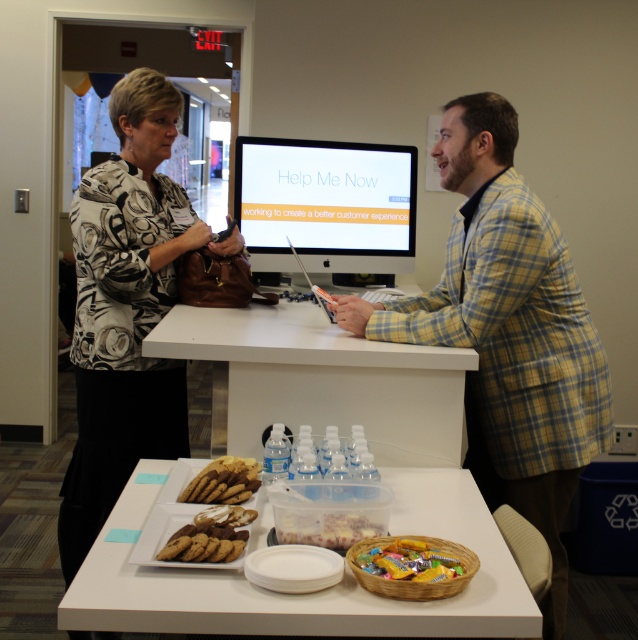
Question: Among these objects, which one is nearest to the camera?

Choices:
 (A) golden crumbly cookies at center
 (B) white plastic table at center

Answer: (A)

Question: Can you confirm if white plastic table at center is wider than shiny plastic basket of candy at lower center?

Choices:
 (A) yes
 (B) no

Answer: (A)

Question: Can you confirm if black printed blouse at center is positioned above white plastic table at center?

Choices:
 (A) no
 (B) yes

Answer: (A)

Question: Observing the image, what is the correct spatial positioning of yellow plaid blazer at center in reference to chocolate-dipped cookies at lower left?

Choices:
 (A) left
 (B) right

Answer: (B)

Question: Which of these objects is positioned farthest from the smooth plastic container at center?

Choices:
 (A) black printed blouse at center
 (B) white plastic table at center
 (C) shiny plastic basket of candy at lower center
 (D) yellow plaid blazer at center

Answer: (A)

Question: Among these points, which one is farthest from the camera?

Choices:
 (A) (334, 157)
 (B) (457, 336)
 (C) (105, 609)

Answer: (A)